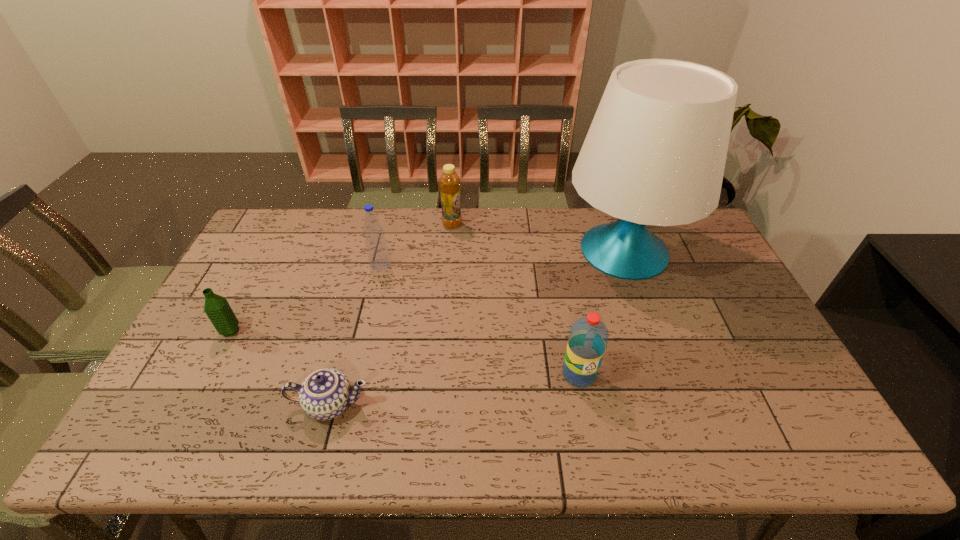
Locate an element on the screen. The height and width of the screenshot is (540, 960). blank area in the image that satisfies the following two spatial constraints: 1. on the back side of the second water bottle from left to right; 2. on the right side of the third object from right to left is located at coordinates (390, 225).

Locate an element on the screen. This screenshot has width=960, height=540. vacant space that satisfies the following two spatial constraints: 1. on the back side of the second water bottle from left to right; 2. on the left side of the third object from right to left is located at coordinates (390, 225).